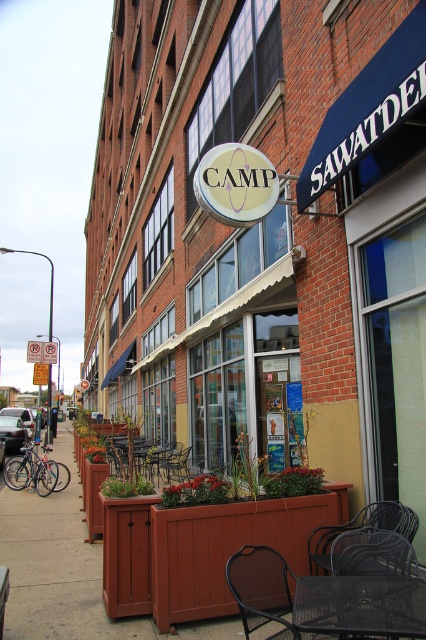
You are standing at the camera position and want to place a 2.3 meter long banner between the metallic mesh table at center and yourself. Is there enough space to place the banner horizontally without folding it?

The metallic mesh table at center and camera are 2.29 meters apart. The banner is 2.3 meters long, so there is not enough space to place it horizontally without folding since the distance is slightly shorter than the banner length.

You are a customer looking for a place to sit. You see a metallic mesh table at center and a black metal chair at center. Which one is bigger?

The metallic mesh table at center is larger in size than the black metal chair at center.

You are a delivery person trying to place a large box on the table. The box is 4 feet wide. Will the metallic mesh table at center and metallic dark brown chair at lower right have enough space between them to accommodate the box?

The metallic mesh table at center and metallic dark brown chair at lower right are 4.58 feet apart, so yes, there is enough space between them to place the 4 feet wide box.